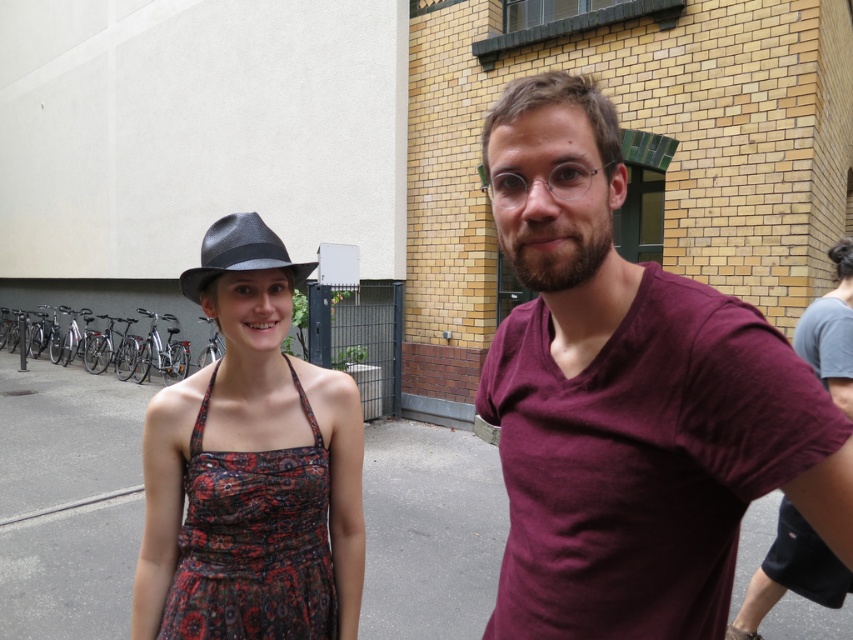
You are a photographer trying to capture a closeup of the maroon cotton t shirt at right. You are currently positioned at the point with coordinates (630, 400). Can you determine if you are already in the correct position to take the photo?

The point at coordinates (630, 400) indicates the location of the maroon cotton t shirt at right, so yes, you are already positioned correctly to take the photo.

You are a photographer trying to capture a clear shot of the printed fabric dress at center and the matte black fedora at center. Which object should you focus on first to ensure both are in focus?

The printed fabric dress at center is closer to the viewer than the matte black fedora at center. To ensure both are in focus, focus on the printed fabric dress at center first, as it is closer, and the depth of field may naturally include the matte black fedora at center in the background.